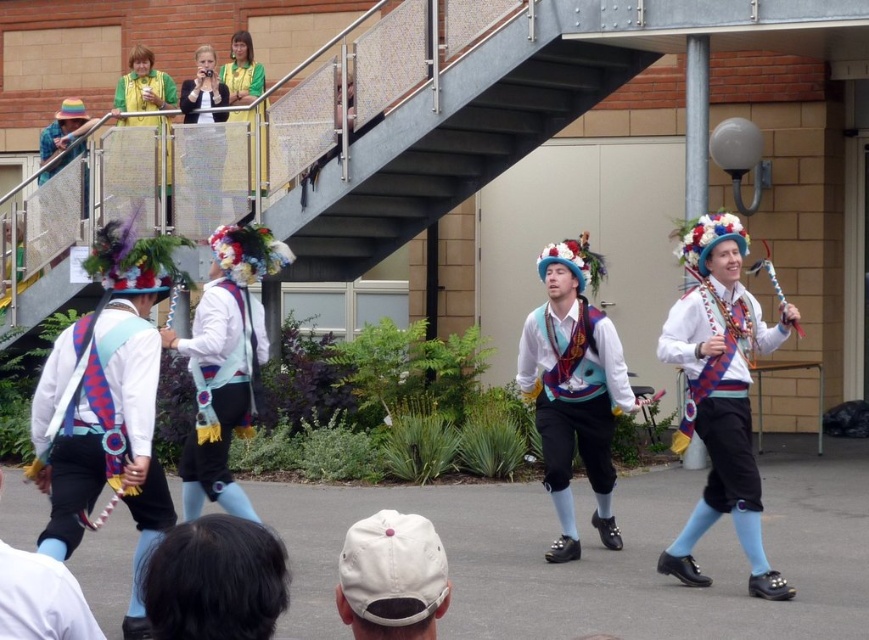
Can you confirm if matte white shirt at upper center is shorter than matte yellow vest at upper left?

Incorrect, matte white shirt at upper center's height does not fall short of matte yellow vest at upper left's.

Does point (194, 134) come closer to viewer compared to point (147, 68)?

Yes, it is in front of point (147, 68).

Where is `matte white shirt at upper center`? This screenshot has width=869, height=640. matte white shirt at upper center is located at coordinates (204, 177).

Where is `matte white shirt at upper center`? The image size is (869, 640). matte white shirt at upper center is located at coordinates (204, 177).

Which of these two, green fabric vest at upper center or matte black vest at upper left, stands taller?

green fabric vest at upper center

Describe the element at coordinates (242, 72) in the screenshot. I see `green fabric vest at upper center` at that location.

This screenshot has width=869, height=640. Find the location of `green fabric vest at upper center`. green fabric vest at upper center is located at coordinates (242, 72).

Does matte blue vest at center come behind matte yellow vest at upper left?

That is False.

The height and width of the screenshot is (640, 869). In order to click on matte blue vest at center in this screenshot , I will do `click(574, 387)`.